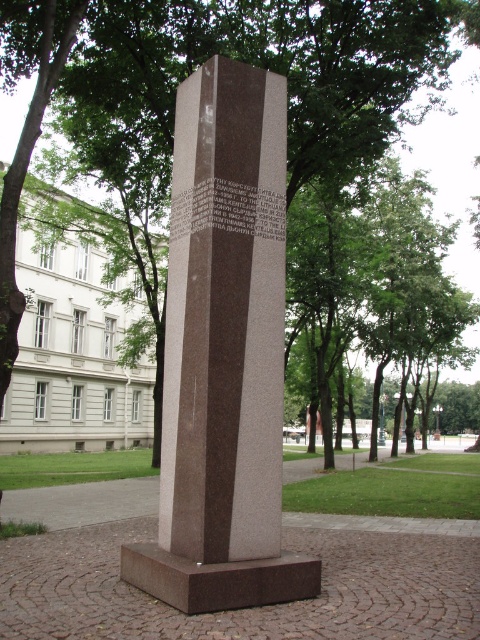
Question: Is brown polished stone monument at center positioned before green leafy tree at center?

Choices:
 (A) yes
 (B) no

Answer: (A)

Question: Which point is closer to the camera?

Choices:
 (A) green leafy tree at center
 (B) brown polished stone monument at center

Answer: (B)

Question: Is brown polished stone monument at center further to the viewer compared to green leafy tree at center?

Choices:
 (A) yes
 (B) no

Answer: (B)

Question: Is brown polished stone monument at center further to the viewer compared to green leafy tree at center?

Choices:
 (A) no
 (B) yes

Answer: (A)

Question: Which object appears closest to the camera in this image?

Choices:
 (A) brown polished stone monument at center
 (B) green leafy tree at center

Answer: (A)